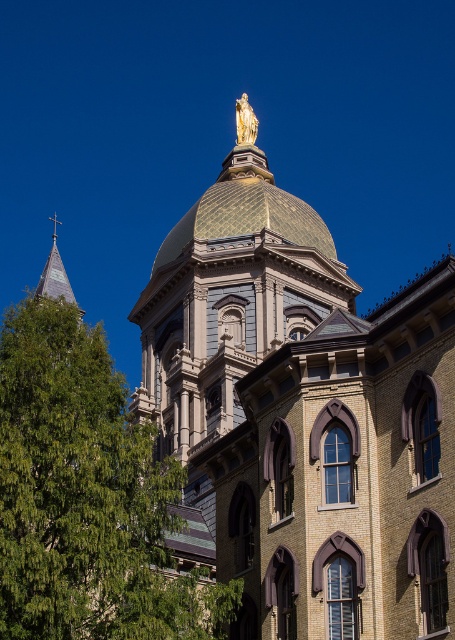
Looking at this image, you are standing in front of the grand building with the golden dome and statue. There is a green leafy tree at lower left. Can you determine the tree is to the left or right side of the building?

The green leafy tree at lower left is located to the left side of the building based on its position at point coordinates.

Consider the image. You are an architect analyzing the spatial layout of the building. Given the presence of the green leafy tree at lower left and the gold textured dome at center, which object occupies a larger horizontal space in the image?

The green leafy tree at lower left has a greater width than the gold textured dome at center, making it occupy a larger horizontal space in the image.

You are an architect analyzing the spatial relationship between the green leafy tree at lower left and the gold textured dome at center. Which object occupies more space in the image?

The green leafy tree at lower left has a larger size compared to the gold textured dome at center, so it occupies more space in the image.